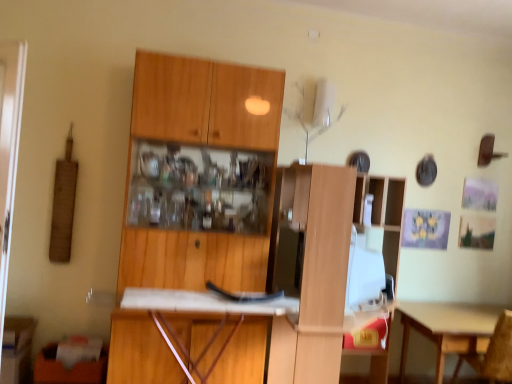
Question: Can you confirm if wooden chair at lower right is taller than light brown wooden table at lower right?

Choices:
 (A) yes
 (B) no

Answer: (A)

Question: From a real-world perspective, is wooden chair at lower right beneath light brown wooden table at lower right?

Choices:
 (A) no
 (B) yes

Answer: (A)

Question: Is wooden chair at lower right positioned far away from light brown wooden table at lower right?

Choices:
 (A) no
 (B) yes

Answer: (A)

Question: Can you confirm if wooden chair at lower right is positioned to the right of light brown wooden table at lower right?

Choices:
 (A) yes
 (B) no

Answer: (A)

Question: Could light brown wooden table at lower right be considered to be inside wooden chair at lower right?

Choices:
 (A) no
 (B) yes

Answer: (A)

Question: From a real-world perspective, is wooden cabinet at center, the first cabinetry from the right, physically located above or below white matte desk at center?

Choices:
 (A) above
 (B) below

Answer: (A)

Question: From the image's perspective, is wooden cabinet at center, the first cabinetry from the right, located above or below white matte desk at center?

Choices:
 (A) below
 (B) above

Answer: (B)

Question: Is wooden cabinet at center, arranged as the second cabinetry when viewed from the left, taller or shorter than white matte desk at center?

Choices:
 (A) tall
 (B) short

Answer: (A)

Question: Looking at their shapes, would you say wooden cabinet at center, arranged as the second cabinetry when viewed from the left, is wider or thinner than white matte desk at center?

Choices:
 (A) thin
 (B) wide

Answer: (B)

Question: From a real-world perspective, is light brown wooden table at lower right positioned above or below wooden cabinet at center, arranged as the second cabinetry when viewed from the left?

Choices:
 (A) below
 (B) above

Answer: (A)

Question: In the image, is light brown wooden table at lower right on the left side or the right side of wooden cabinet at center, arranged as the second cabinetry when viewed from the left?

Choices:
 (A) left
 (B) right

Answer: (B)

Question: From their relative heights in the image, would you say light brown wooden table at lower right is taller or shorter than wooden cabinet at center, arranged as the second cabinetry when viewed from the left?

Choices:
 (A) short
 (B) tall

Answer: (A)

Question: Considering their positions, is light brown wooden table at lower right located in front of or behind wooden cabinet at center, the first cabinetry from the right?

Choices:
 (A) front
 (B) behind

Answer: (B)

Question: From the image's perspective, is wooden cabinet at center, the first cabinetry from the right, located above or below wooden chair at lower right?

Choices:
 (A) above
 (B) below

Answer: (A)

Question: In the image, is wooden cabinet at center, the first cabinetry from the right, positioned in front of or behind wooden chair at lower right?

Choices:
 (A) behind
 (B) front

Answer: (B)